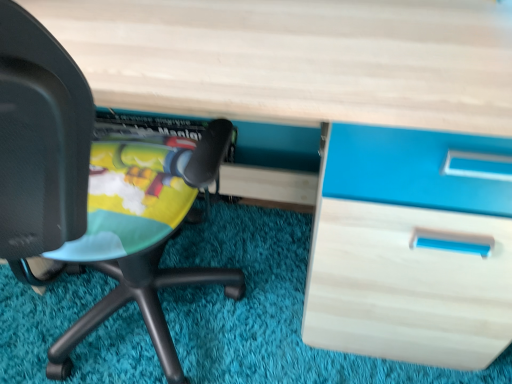
Identify the location of matte black chair at left. (64, 145).

Describe the element at coordinates (64, 145) in the screenshot. I see `matte black chair at left` at that location.

Locate an element on the screen. The height and width of the screenshot is (384, 512). matte black chair at left is located at coordinates (64, 145).